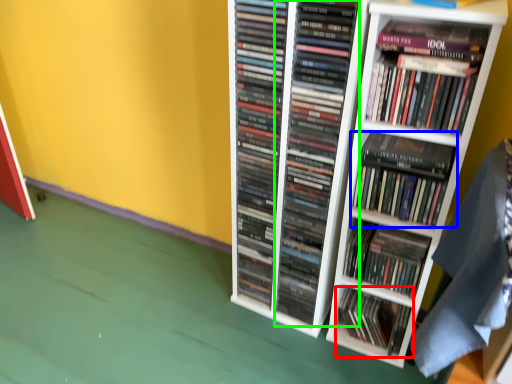
Question: Which object is the closest to the book (highlighted by a red box)? Choose among these: book (highlighted by a blue box) or book (highlighted by a green box).

Choices:
 (A) book
 (B) book

Answer: (B)